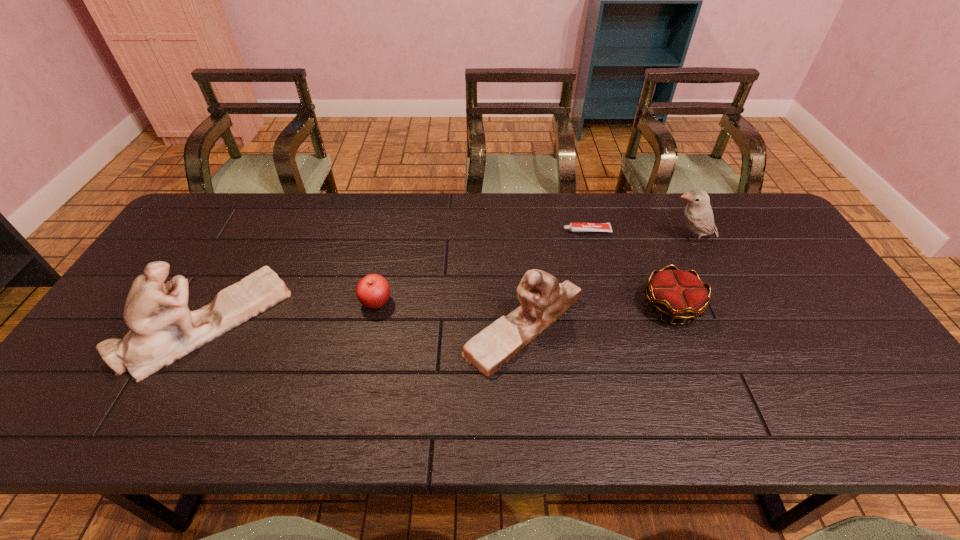
This screenshot has height=540, width=960. I want to click on free spot located on the front-facing side of the right figurine, so click(431, 327).

Locate an element on the screen. The image size is (960, 540). free space located 0.060m at the nozzle of the shortest object is located at coordinates (544, 231).

Find the location of a particular element. This screenshot has width=960, height=540. vacant space located at the nozzle of the shortest object is located at coordinates (518, 231).

You are a GUI agent. You are given a task and a screenshot of the screen. Output one action in this format:
    pyautogui.click(x=<x>, y=<y>)
    Task: Click on the free space located at the nozzle of the shortest object
    This screenshot has height=540, width=960.
    Given the screenshot: What is the action you would take?
    pyautogui.click(x=525, y=231)

Where is `free space located on the right of the crown`? free space located on the right of the crown is located at coordinates (828, 307).

Find the location of a particular element. free space located at the face of the bird is located at coordinates (641, 241).

The image size is (960, 540). Find the location of `vacant area located 0.260m at the face of the bird`. vacant area located 0.260m at the face of the bird is located at coordinates (579, 241).

The image size is (960, 540). I want to click on vacant space located 0.160m at the face of the bird, so click(612, 241).

At what (x,y) coordinates should I click in order to perform the action: click on free space located 0.210m on the left of the apple. Please return your answer as a coordinate pair (x, y). The image size is (960, 540). Looking at the image, I should click on pos(282,303).

This screenshot has width=960, height=540. In order to click on toothpaste that is at the far edge in this screenshot , I will do `click(574, 226)`.